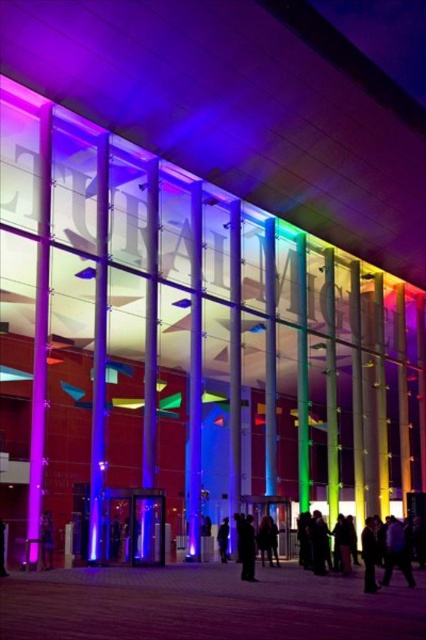
You are trying to decide which garment to take with you for a night out. You have a limited backpack space. Given the scene, which of the two items, the black matte coat at center or the black leather jacket at lower left, would you choose and why?

The black leather jacket at lower left is smaller than the black matte coat at center, so it would take up less space in the backpack. Therefore, you should choose the black leather jacket at lower left to conserve space.

You are a security guard at the ETHAMIC building. You notice two items on the ground outside the building. The items are the black leather jacket at lower left and the black fabric at center. Which item is larger in size?

The black leather jacket at lower left is bigger than the black fabric at center, so the black leather jacket at lower left is larger in size.